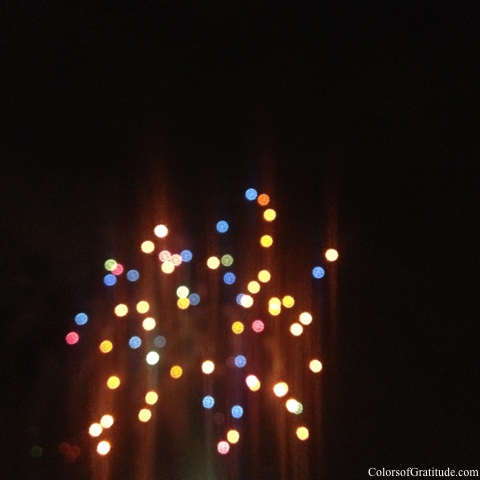
Where is `the bottom most yellow light`? This screenshot has height=480, width=480. the bottom most yellow light is located at coordinates (300, 434).